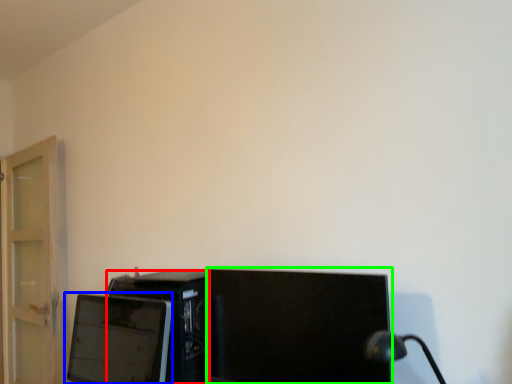
Question: Based on their relative distances, which object is farther from desktop computer (highlighted by a red box)? Choose from computer monitor (highlighted by a blue box) and computer monitor (highlighted by a green box).

Choices:
 (A) computer monitor
 (B) computer monitor

Answer: (B)